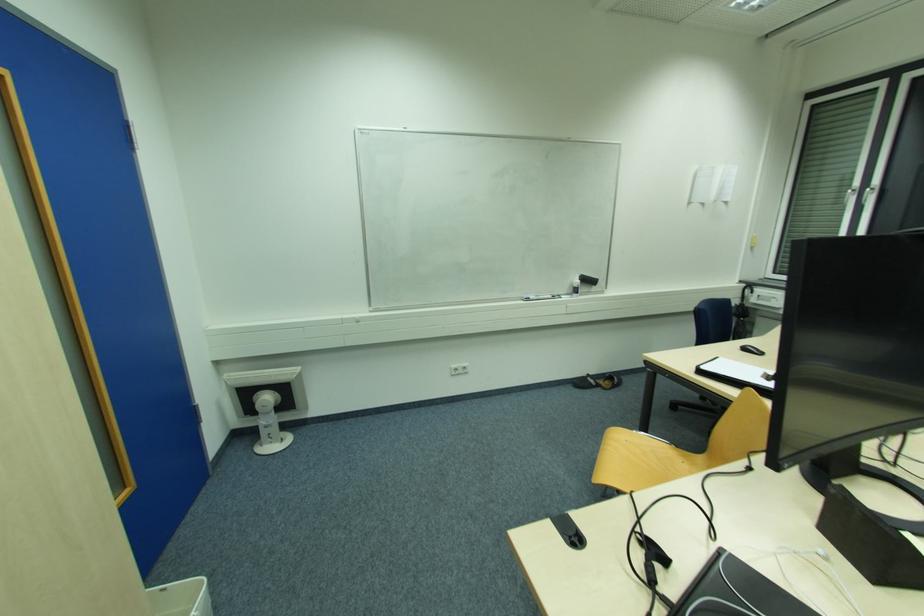
Where would you lift the whiteboard marker? Please return your answer as a coordinate pair (x, y).

(481, 216)